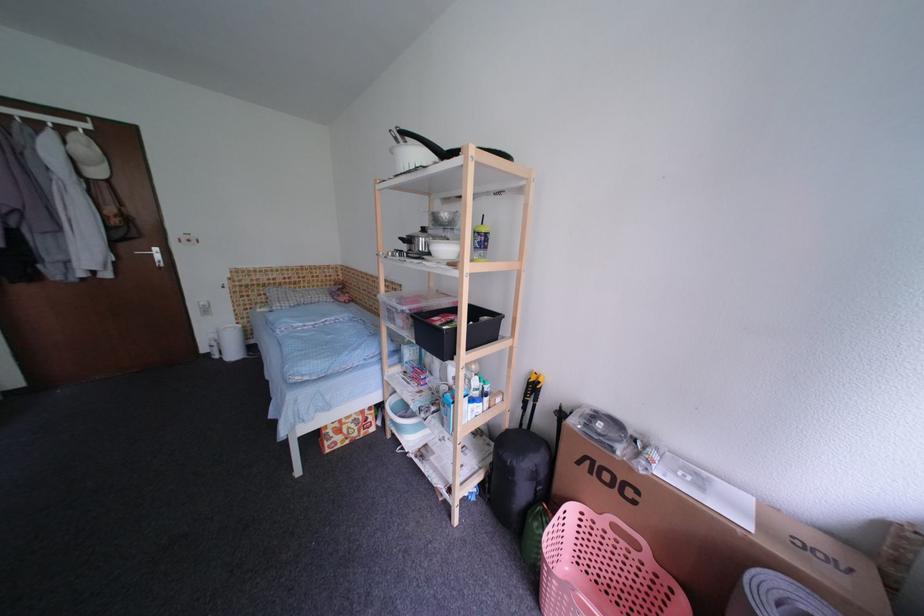
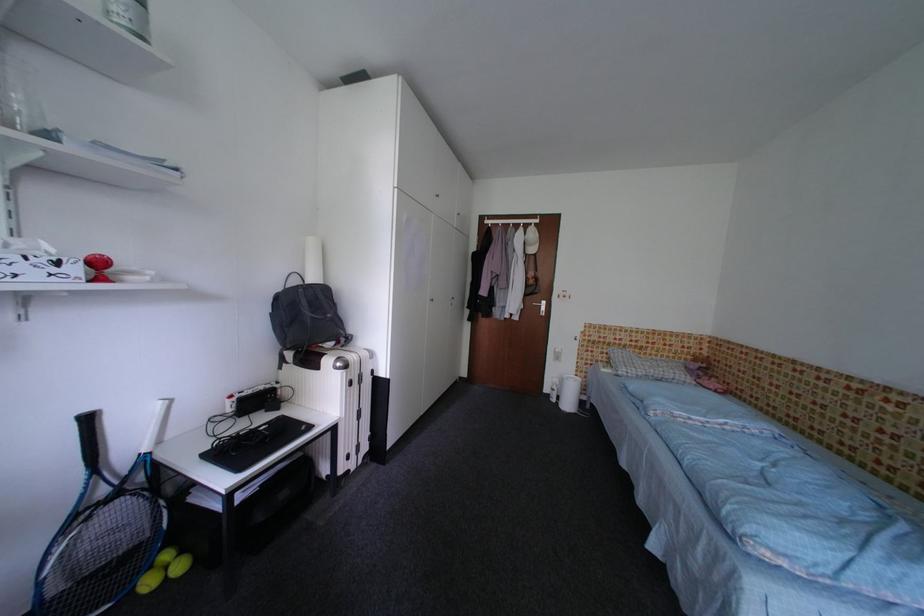
In the second image, find the point that corresponds to the point at 129,246 in the first image.

(536, 300)